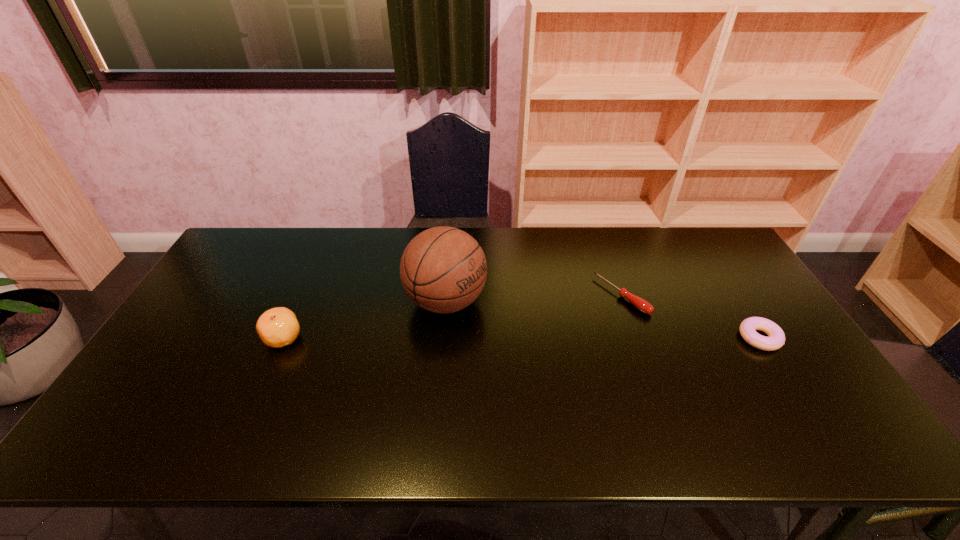
Find the location of a particular element. the leftmost object is located at coordinates tap(277, 327).

Where is `the second tallest object`? Image resolution: width=960 pixels, height=540 pixels. the second tallest object is located at coordinates (277, 327).

Where is `doughnut`? doughnut is located at coordinates (776, 339).

Identify the location of the second object from right to left. The width and height of the screenshot is (960, 540). (641, 304).

This screenshot has height=540, width=960. I want to click on the second object from left to right, so click(x=443, y=269).

Identify the location of basketball. This screenshot has height=540, width=960. (443, 269).

Identify the location of vacant space positioned on the back of the third shortest object. (324, 244).

The width and height of the screenshot is (960, 540). Find the location of `free space located on the left of the rightmost object`. free space located on the left of the rightmost object is located at coordinates 613,338.

This screenshot has height=540, width=960. I want to click on vacant region located 0.390m at the tip of the screwdriver, so click(x=507, y=374).

Locate an element on the screen. vacant point located at the tip of the screwdriver is located at coordinates (579, 327).